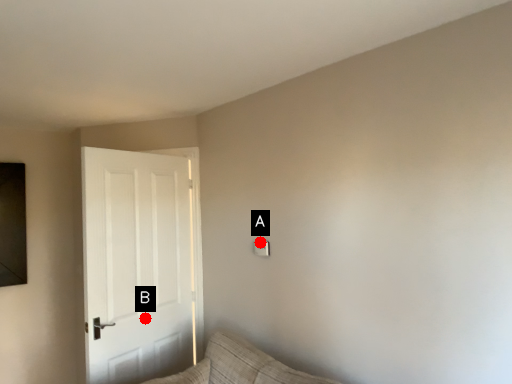
Question: Two points are circled on the image, labeled by A and B beside each circle. Which of the following is the closest to the observer?

Choices:
 (A) A is closer
 (B) B is closer

Answer: (A)